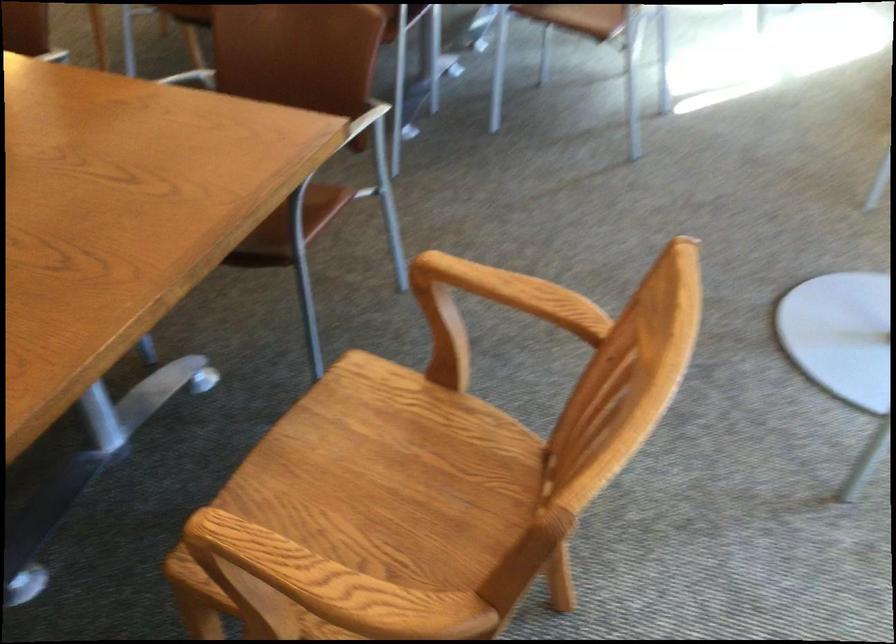
You are a GUI agent. You are given a task and a screenshot of the screen. Output one action in this format:
    pyautogui.click(x=<x>, y=<y>)
    Task: Click on the brown chair sitting surface
    The image size is (896, 644).
    Given the screenshot: What is the action you would take?
    pyautogui.click(x=289, y=228)